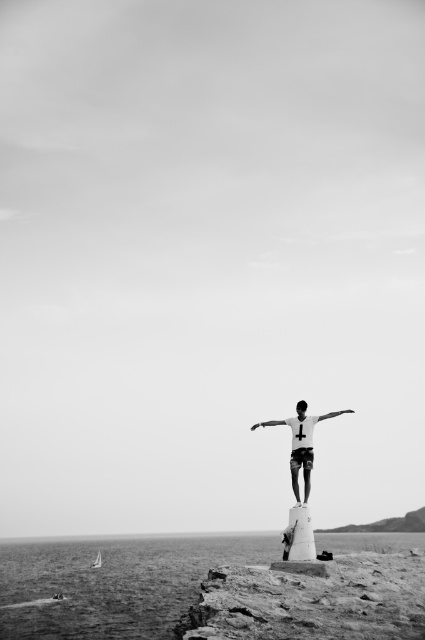
Question: Which object is farther from the camera taking this photo?

Choices:
 (A) white matte shirt at center
 (B) white matte arm at center
 (C) smooth metallic arm at center
 (D) smooth water at lower left

Answer: (D)

Question: Can you confirm if white matte shirt at center is positioned above smooth metallic arm at center?

Choices:
 (A) no
 (B) yes

Answer: (A)

Question: Does smooth water at lower left appear under smooth metallic arm at center?

Choices:
 (A) yes
 (B) no

Answer: (A)

Question: Among these points, which one is farthest from the camera?

Choices:
 (A) (61, 612)
 (B) (336, 413)

Answer: (A)

Question: Observing the image, what is the correct spatial positioning of white matte shirt at center in reference to smooth metallic arm at center?

Choices:
 (A) above
 (B) below

Answer: (B)

Question: Which point is farther to the camera?

Choices:
 (A) white matte arm at center
 (B) white matte shirt at center
 (C) smooth water at lower left

Answer: (C)